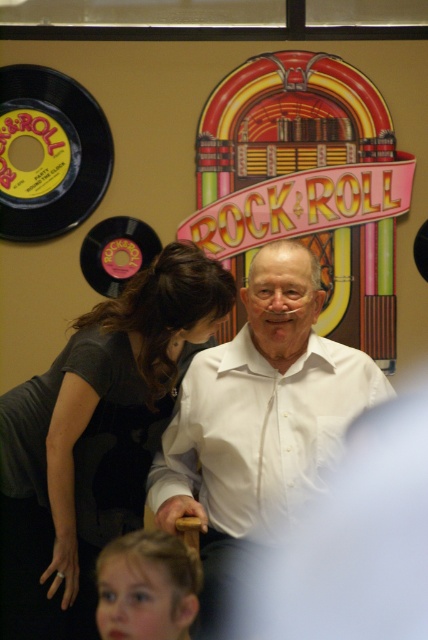
Can you confirm if dark gray shirt at center is shorter than white smooth shirt at center?

No.

Does dark gray shirt at center have a lesser width compared to white smooth shirt at center?

Indeed, dark gray shirt at center has a lesser width compared to white smooth shirt at center.

Between point (118, 358) and point (273, 497), which one is positioned behind?

The point (273, 497) is behind.

This screenshot has width=428, height=640. I want to click on dark gray shirt at center, so click(92, 436).

In the scene shown: Can you confirm if dark gray shirt at center is positioned below blonde hair at lower left?

Actually, dark gray shirt at center is above blonde hair at lower left.

Is dark gray shirt at center to the right of blonde hair at lower left from the viewer's perspective?

Incorrect, dark gray shirt at center is not on the right side of blonde hair at lower left.

Does point (18, 435) come closer to viewer compared to point (157, 614)?

No, it is not.

The height and width of the screenshot is (640, 428). Find the location of `dark gray shirt at center`. dark gray shirt at center is located at coordinates coord(92,436).

Who is lower down, white smooth shirt at center or blonde hair at lower left?

blonde hair at lower left is below.

Who is shorter, white smooth shirt at center or blonde hair at lower left?

blonde hair at lower left is shorter.

Is point (284, 289) positioned after point (118, 589)?

Yes.

At what (x,y) coordinates should I click in order to perform the action: click on white smooth shirt at center. Please return your answer as a coordinate pair (x, y). The width and height of the screenshot is (428, 640). Looking at the image, I should click on (258, 413).